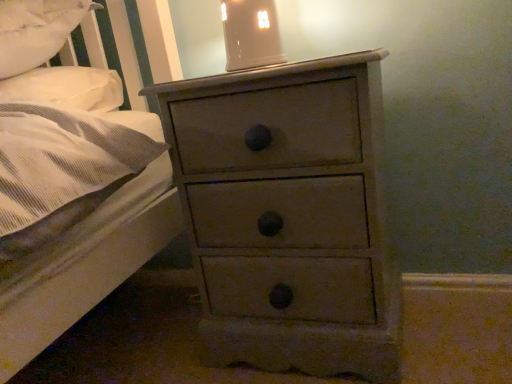
Question: From a real-world perspective, relative to distressed gray chest of drawers at center, is white soft pillow at upper left vertically above or below?

Choices:
 (A) above
 (B) below

Answer: (A)

Question: Based on their sizes in the image, would you say white soft pillow at upper left is bigger or smaller than distressed gray chest of drawers at center?

Choices:
 (A) small
 (B) big

Answer: (A)

Question: Estimate the real-world distances between objects in this image. Which object is closer to the matte ceramic lampshade at upper center?

Choices:
 (A) white soft pillow at upper left
 (B) distressed gray chest of drawers at center

Answer: (B)

Question: Considering the real-world distances, which object is closest to the distressed gray chest of drawers at center?

Choices:
 (A) matte ceramic lampshade at upper center
 (B) white soft pillow at upper left

Answer: (A)